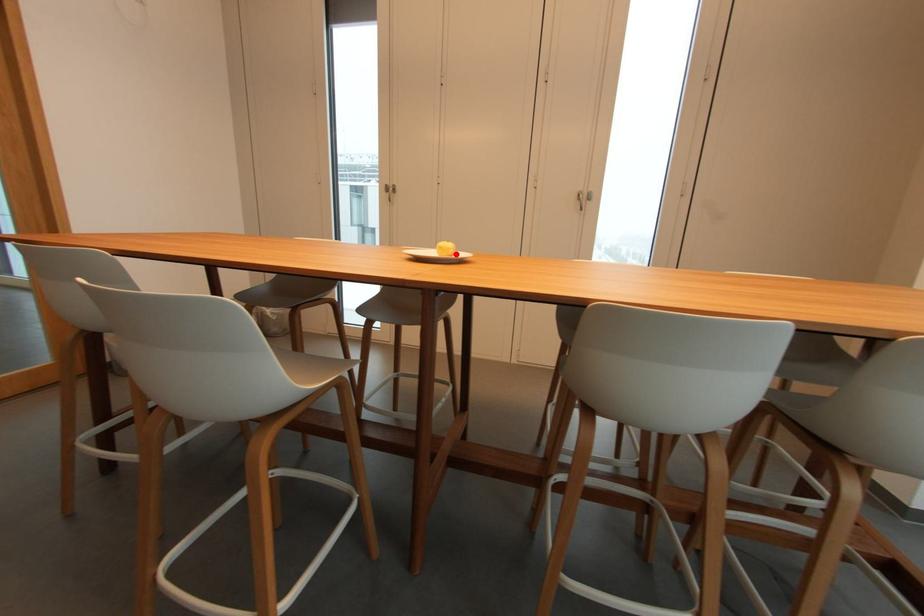
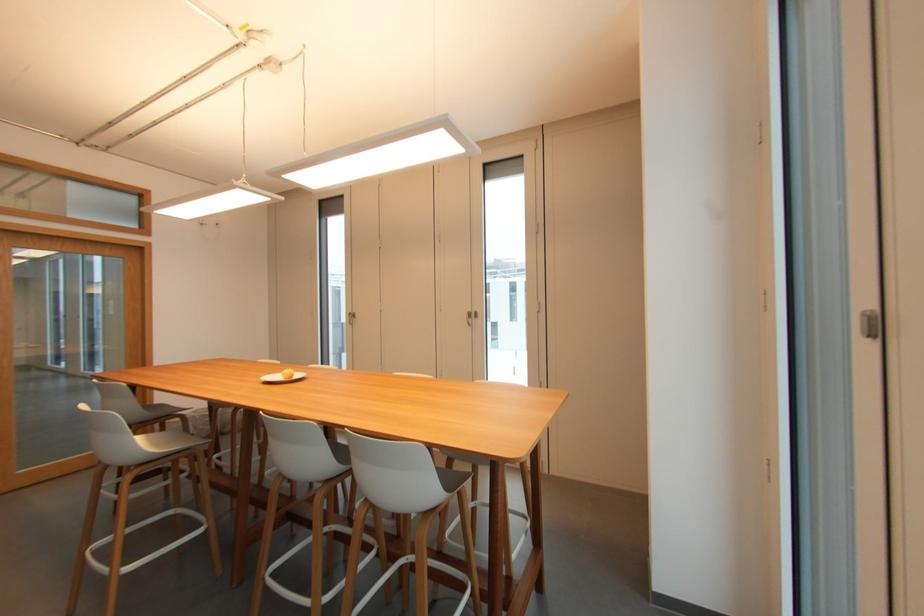
Question: I am providing you with two images of the same scene from different viewpoints. Image1 has a red point marked. In image2, the corresponding 3D location appears at what relative position? Reply with the corresponding letter.

Choices:
 (A) Closer
 (B) Farther

Answer: (A)